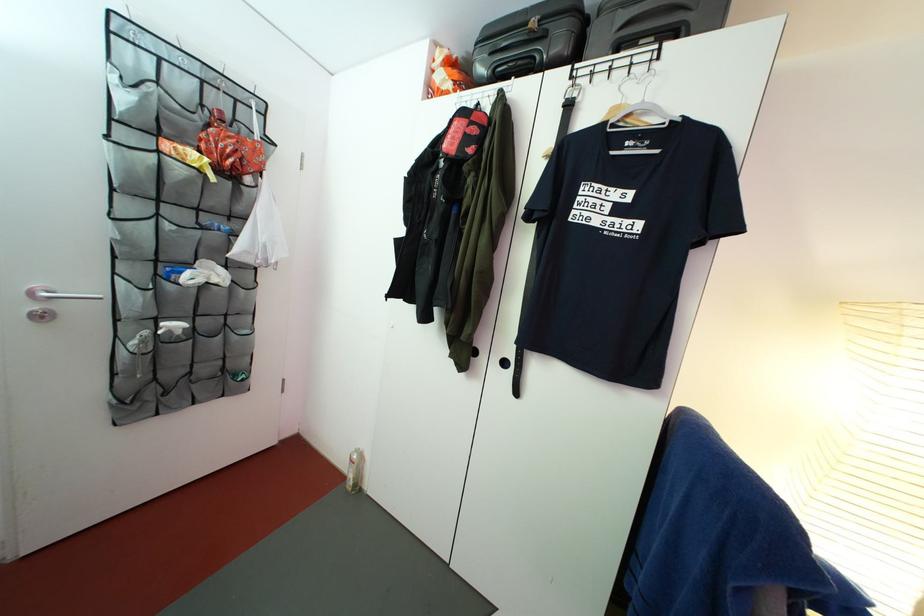
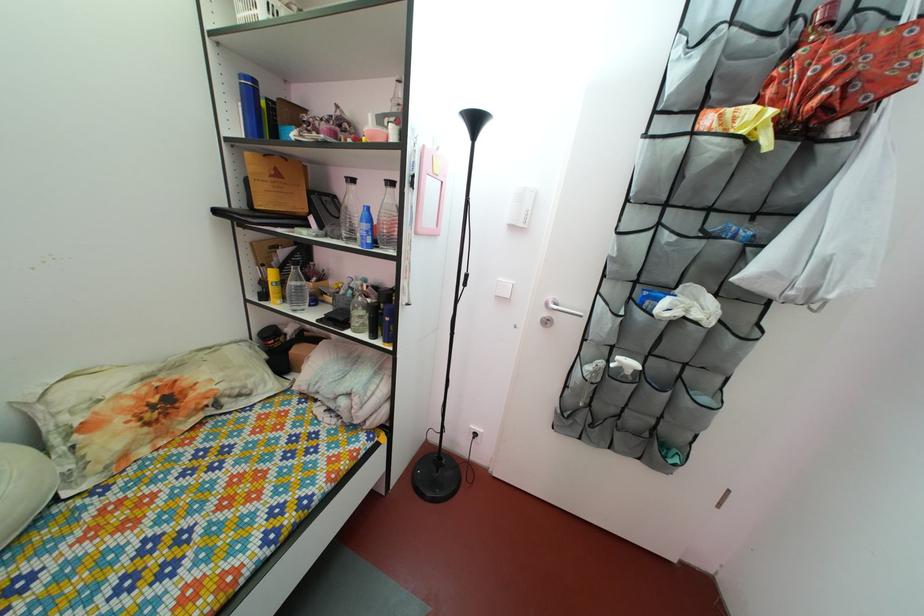
In the second image, find the point that corresponds to point 233,167 in the first image.

(816, 103)